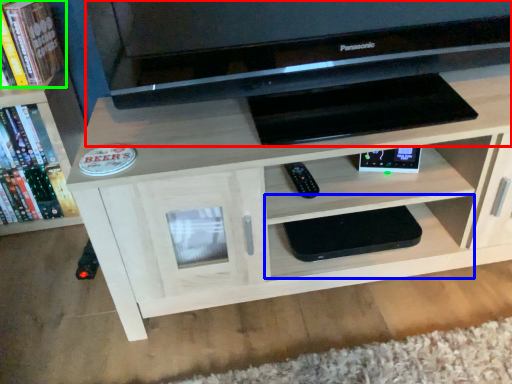
Question: Which object is positioned farthest from computer (highlighted by a red box)? Select from shelf (highlighted by a blue box) and book (highlighted by a green box).

Choices:
 (A) shelf
 (B) book

Answer: (B)